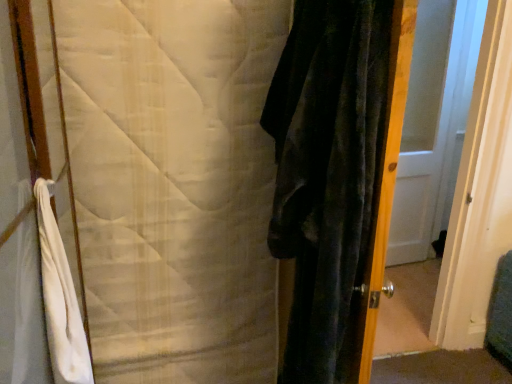
Question: From a real-world perspective, is white glossy door at center positioned above or below white quilted blanket at left?

Choices:
 (A) below
 (B) above

Answer: (B)

Question: Would you say white glossy door at center is to the left or to the right of white quilted blanket at left in the picture?

Choices:
 (A) right
 (B) left

Answer: (A)

Question: Based on their relative distances, which object is farther from the white glossy door at center?

Choices:
 (A) white cotton bath towel at left
 (B) velvet dark green screen door at right
 (C) white quilted blanket at left

Answer: (A)

Question: Estimate the real-world distances between objects in this image. Which object is closer to the white glossy door at center?

Choices:
 (A) white quilted blanket at left
 (B) white cotton bath towel at left
 (C) velvet dark green screen door at right

Answer: (C)